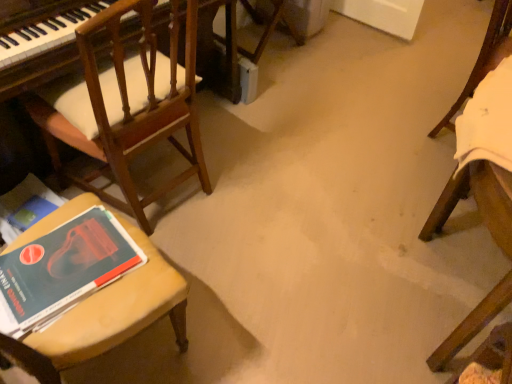
Question: Looking at the image, does hardcover book at lower left seem bigger or smaller compared to wooden chair at left, acting as the first chair starting from the left?

Choices:
 (A) big
 (B) small

Answer: (B)

Question: From their relative heights in the image, would you say hardcover book at lower left is taller or shorter than wooden chair at left, acting as the first chair starting from the left?

Choices:
 (A) short
 (B) tall

Answer: (A)

Question: Which of these objects is positioned farthest from the hardcover book at lower left?

Choices:
 (A) wooden chair at left, acting as the first chair starting from the left
 (B) white fabric chair at right, arranged as the 1th chair when viewed from the right

Answer: (B)

Question: Estimate the real-world distances between objects in this image. Which object is farther from the hardcover book at lower left?

Choices:
 (A) wooden chair at left, placed as the 2th chair when sorted from right to left
 (B) white fabric chair at right, arranged as the 1th chair when viewed from the right

Answer: (B)